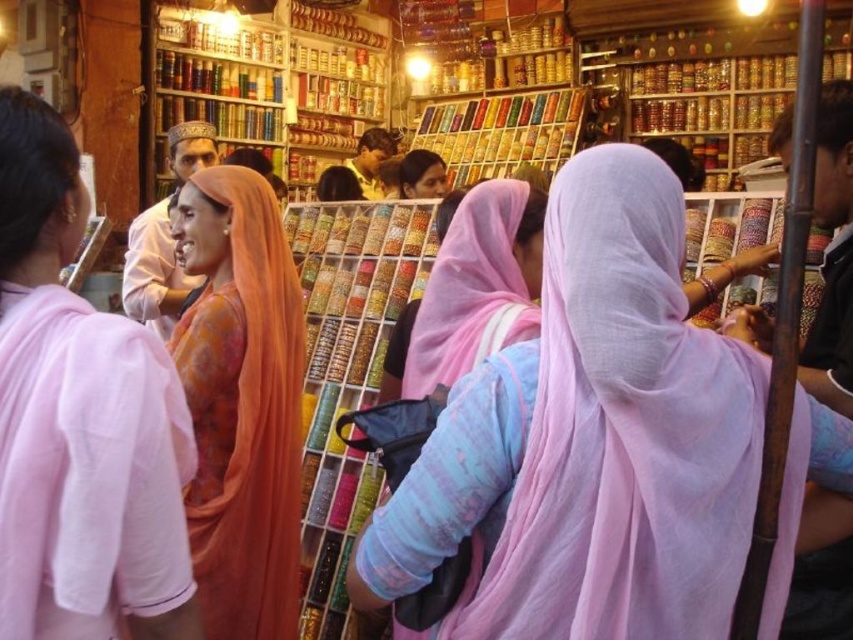
Question: Which point is closer to the camera?

Choices:
 (A) coord(265,257)
 (B) coord(494,205)
 (C) coord(401,163)
 (D) coord(445,356)

Answer: (D)

Question: Among these objects, which one is farthest from the camera?

Choices:
 (A) orange silk saree at left
 (B) matte orange robe at center
 (C) light pink sheer scarf at center
 (D) orange silk saree at center

Answer: (B)

Question: Can you confirm if orange silk saree at left is positioned to the left of matte pink scarf at center?

Choices:
 (A) no
 (B) yes

Answer: (B)

Question: Is light blue fabric at center further to camera compared to matte orange robe at center?

Choices:
 (A) yes
 (B) no

Answer: (B)

Question: Observing the image, what is the correct spatial positioning of orange silk saree at center in reference to pink sheer shawl at center?

Choices:
 (A) above
 (B) below

Answer: (B)

Question: Which point is closer to the camera?

Choices:
 (A) light pink sheer scarf at center
 (B) orange silk robe at center
 (C) pink sheer shawl at center
 (D) matte pink scarf at center

Answer: (A)